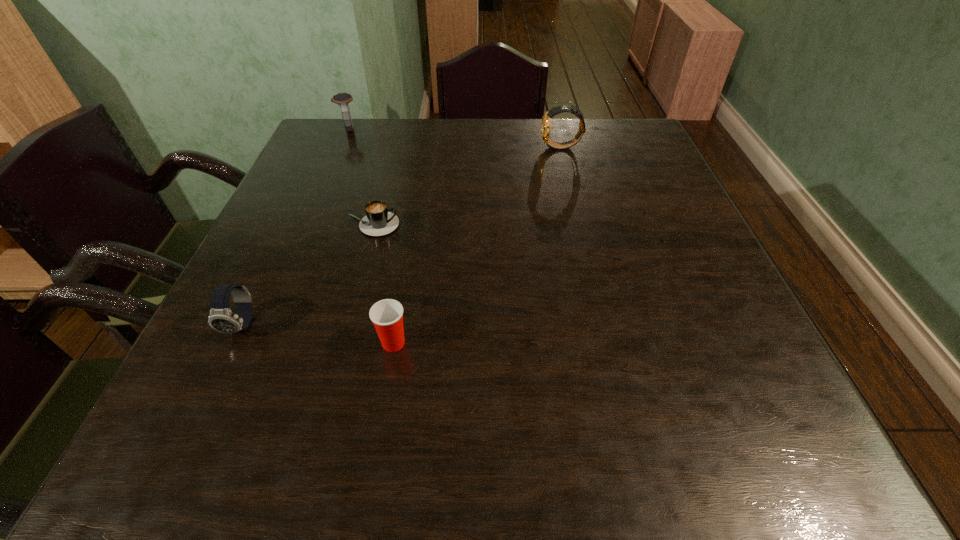
Identify which object is the second closest to the farthest object. Please provide its 2D coordinates. Your answer should be formatted as a tuple, i.e. [(x, y)], where the tuple contains the x and y coordinates of a point satisfying the conditions above.

[(546, 119)]

Find the location of a particular element. The image size is (960, 540). object that ranks as the second closest to the nearest watch is located at coordinates (387, 315).

Choose which watch is the nearest neighbor to the second object from right to left. Please provide its 2D coordinates. Your answer should be formatted as a tuple, i.e. [(x, y)], where the tuple contains the x and y coordinates of a point satisfying the conditions above.

[(221, 318)]

Image resolution: width=960 pixels, height=540 pixels. In order to click on watch that is the second closest one to the farthest watch in this screenshot , I will do `click(221, 318)`.

This screenshot has width=960, height=540. In order to click on vacant space that satisfies the following two spatial constraints: 1. on the face of the tallest watch; 2. on the face of the nearest watch in this screenshot , I will do `click(606, 325)`.

Where is `vacant position in the image that satisfies the following two spatial constraints: 1. on the front side of the Dixie cup; 2. on the right side of the farthest object`? Image resolution: width=960 pixels, height=540 pixels. vacant position in the image that satisfies the following two spatial constraints: 1. on the front side of the Dixie cup; 2. on the right side of the farthest object is located at coordinates (258, 343).

Identify the location of blank area in the image that satisfies the following two spatial constraints: 1. with the handle on the side of the shortest object; 2. on the face of the nearest watch. (346, 325).

Where is `free point that satisfies the following two spatial constraints: 1. on the face of the rightmost object; 2. on the face of the nearest watch`? free point that satisfies the following two spatial constraints: 1. on the face of the rightmost object; 2. on the face of the nearest watch is located at coordinates (606, 325).

The height and width of the screenshot is (540, 960). I want to click on free spot that satisfies the following two spatial constraints: 1. with the handle on the side of the third nearest object; 2. on the back side of the Dixie cup, so click(x=341, y=343).

Locate an element on the screen. The height and width of the screenshot is (540, 960). free point that satisfies the following two spatial constraints: 1. with the handle on the side of the third farthest object; 2. on the left side of the second object from right to left is located at coordinates (341, 343).